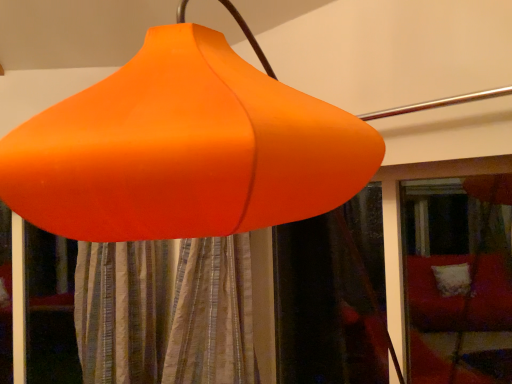
This screenshot has height=384, width=512. Describe the element at coordinates (166, 312) in the screenshot. I see `silky striped curtain at center` at that location.

This screenshot has height=384, width=512. I want to click on silky striped curtain at center, so click(x=166, y=312).

You are a GUI agent. You are given a task and a screenshot of the screen. Output one action in this format:
    pyautogui.click(x=<x>, y=<y>)
    Task: Click on the silky striped curtain at center
    This screenshot has height=384, width=512.
    Given the screenshot: What is the action you would take?
    pyautogui.click(x=166, y=312)